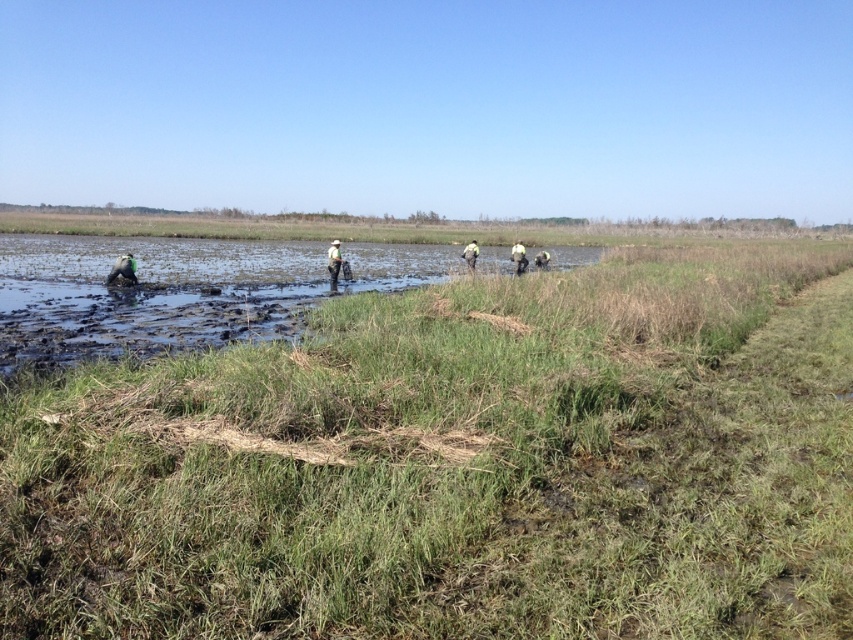
Is point (125, 259) positioned after point (471, 243)?

That is False.

Is point (131, 280) positioned behind point (463, 246)?

No, it is in front of (463, 246).

Identify the location of dark green fabric at lower left. This screenshot has width=853, height=640. (123, 268).

Which is more to the left, green grass at center or dark green fabric at lower left?

From the viewer's perspective, dark green fabric at lower left appears more on the left side.

The height and width of the screenshot is (640, 853). Find the location of `green grass at center`. green grass at center is located at coordinates (457, 467).

What are the coordinates of `green grass at center` in the screenshot? It's located at (457, 467).

Who is shorter, dark green fabric at lower left or white matte hat at center?

dark green fabric at lower left is shorter.

Between dark green fabric at lower left and white matte hat at center, which one is positioned higher?

white matte hat at center is higher up.

Who is more forward, (135,262) or (334,248)?

Point (135,262)

This screenshot has height=640, width=853. Find the location of `dark green fabric at lower left`. dark green fabric at lower left is located at coordinates (123, 268).